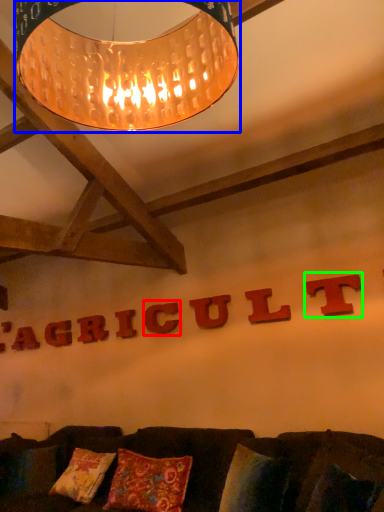
Question: Which is nearer to the letter (highlighted by a red box)? lamp (highlighted by a blue box) or letter (highlighted by a green box).

Choices:
 (A) lamp
 (B) letter

Answer: (B)